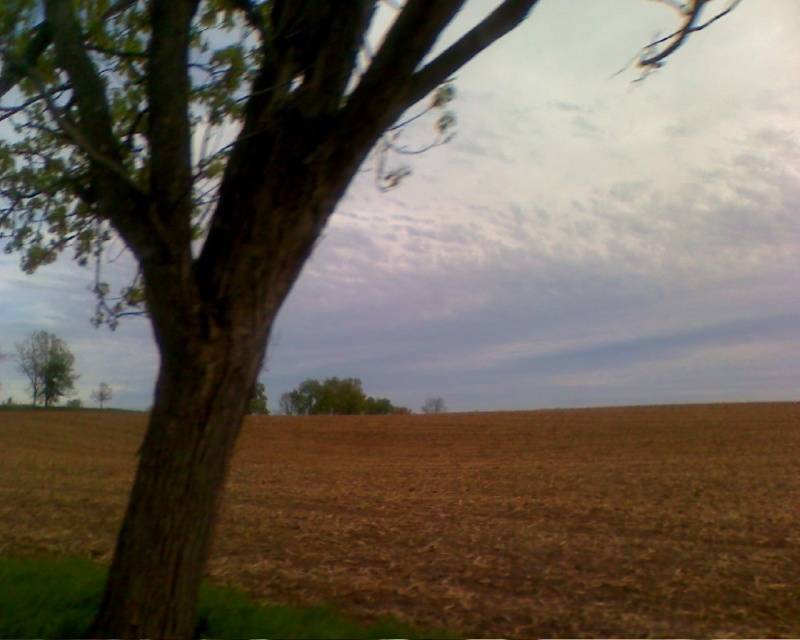
Question: Based on their relative distances, which object is farther from the brown soil at center?

Choices:
 (A) green matte tree at lower left
 (B) green matte tree at center
 (C) green leafy tree at center
 (D) green rough bark tree at center

Answer: (C)

Question: Based on their relative distances, which object is nearer to the green matte tree at center?

Choices:
 (A) green leafy tree at center
 (B) green leafy tree at left
 (C) brown soil at center
 (D) green rough bark tree at center

Answer: (A)

Question: Among these objects, which one is nearest to the camera?

Choices:
 (A) green leafy tree at center
 (B) green matte tree at lower left

Answer: (B)

Question: Does green leafy tree at center appear on the right side of green matte tree at center?

Choices:
 (A) yes
 (B) no

Answer: (B)

Question: Does green leafy tree at center have a greater width compared to green matte tree at center?

Choices:
 (A) no
 (B) yes

Answer: (A)

Question: Is green leafy tree at left closer to the viewer compared to green matte tree at center?

Choices:
 (A) no
 (B) yes

Answer: (B)